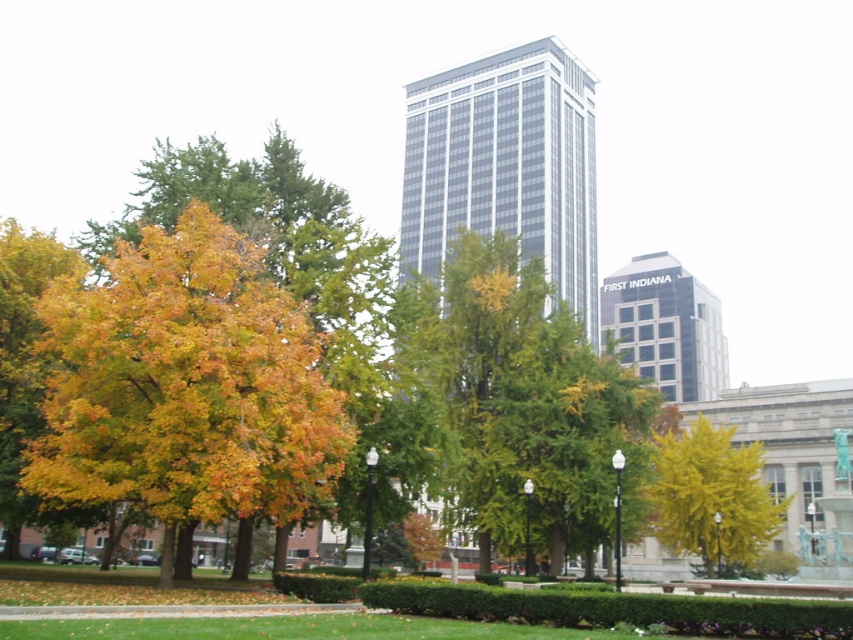
Based on the photo, does green leafy tree at center have a lesser height compared to yellow/golden leaves at center?

No, green leafy tree at center is not shorter than yellow/golden leaves at center.

Image resolution: width=853 pixels, height=640 pixels. Describe the element at coordinates (519, 401) in the screenshot. I see `green leafy tree at center` at that location.

Is point (502, 301) positioned after point (656, 490)?

No, it is not.

Locate an element on the screen. green leafy tree at center is located at coordinates (519, 401).

Who is lower down, golden yellow leaves at left or green leafy tree at center?

Positioned lower is golden yellow leaves at left.

Which of these two, golden yellow leaves at left or green leafy tree at center, stands taller?

green leafy tree at center is taller.

Is point (202, 488) more distant than point (544, 461)?

No, it is in front of (544, 461).

The width and height of the screenshot is (853, 640). In order to click on golden yellow leaves at left in this screenshot , I will do (184, 387).

Is golden yellow leaves at left positioned in front of yellow/golden leaves at center?

Yes, it is in front of yellow/golden leaves at center.

Is point (172, 282) positioned before point (712, 540)?

Yes, it is in front of point (712, 540).

What are the coordinates of `golden yellow leaves at left` in the screenshot? It's located at (184, 387).